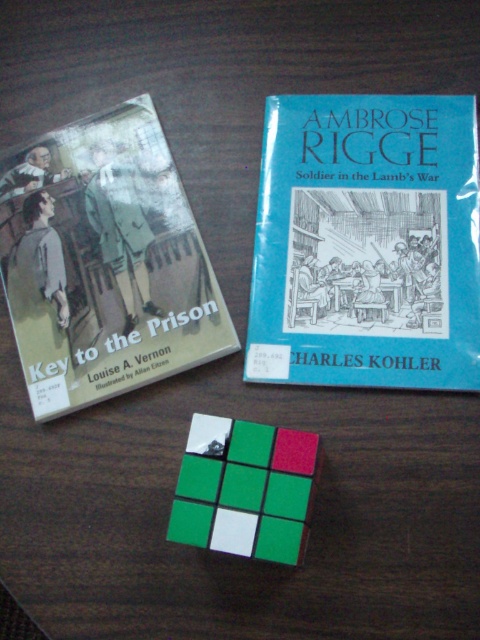
Question: Is blue paperback book at upper right smaller than matte paper book at left?

Choices:
 (A) no
 (B) yes

Answer: (B)

Question: Does blue paperback book at upper right appear on the left side of matte paper book at left?

Choices:
 (A) yes
 (B) no

Answer: (B)

Question: Is matte paper book at left closer to camera compared to green matte rubik's cube at center?

Choices:
 (A) no
 (B) yes

Answer: (A)

Question: Which object is closer to the camera taking this photo?

Choices:
 (A) matte paper book at left
 (B) green matte rubik's cube at center

Answer: (B)

Question: Which object appears closest to the camera in this image?

Choices:
 (A) matte paper book at left
 (B) blue paperback book at upper right
 (C) green matte rubik's cube at center

Answer: (C)

Question: Which point is farther from the camera taking this photo?

Choices:
 (A) (110, 150)
 (B) (241, 532)
 (C) (408, 269)

Answer: (A)